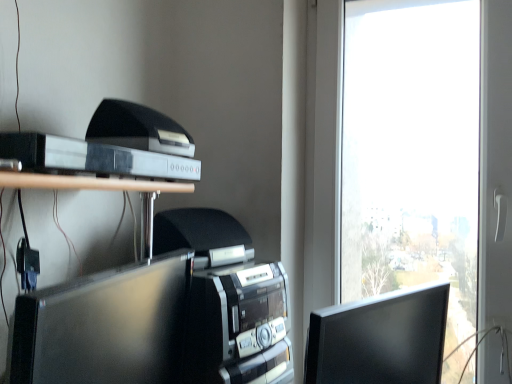
Question: Is black plastic printer at upper left a part of matte black monitor at right, the first computer monitor positioned from the right?

Choices:
 (A) no
 (B) yes

Answer: (A)

Question: Considering the relative sizes of matte black monitor at right, which is the 2th computer monitor from left to right, and black plastic printer at upper left in the image provided, is matte black monitor at right, which is the 2th computer monitor from left to right, thinner than black plastic printer at upper left?

Choices:
 (A) no
 (B) yes

Answer: (A)

Question: Considering the relative positions of matte black monitor at right, which is the 2th computer monitor from left to right, and black plastic printer at upper left in the image provided, is matte black monitor at right, which is the 2th computer monitor from left to right, to the right of black plastic printer at upper left from the viewer's perspective?

Choices:
 (A) yes
 (B) no

Answer: (A)

Question: From a real-world perspective, is matte black monitor at right, which is the 2th computer monitor from left to right, under black plastic printer at upper left?

Choices:
 (A) yes
 (B) no

Answer: (A)

Question: Is matte black monitor at right, which is the 2th computer monitor from left to right, shorter than black plastic printer at upper left?

Choices:
 (A) no
 (B) yes

Answer: (A)

Question: In terms of width, does matte black monitor at center, marked as the second computer monitor in a right-to-left arrangement, look wider or thinner when compared to matte black monitor at right, the first computer monitor positioned from the right?

Choices:
 (A) thin
 (B) wide

Answer: (B)

Question: From a real-world perspective, relative to matte black monitor at right, the first computer monitor positioned from the right, is matte black monitor at center, marked as the second computer monitor in a right-to-left arrangement, vertically above or below?

Choices:
 (A) above
 (B) below

Answer: (A)

Question: Would you say matte black monitor at center, which appears as the first computer monitor when viewed from the left, is to the left or to the right of matte black monitor at right, the first computer monitor positioned from the right, in the picture?

Choices:
 (A) left
 (B) right

Answer: (A)

Question: In terms of size, does matte black monitor at center, which appears as the first computer monitor when viewed from the left, appear bigger or smaller than matte black monitor at right, the first computer monitor positioned from the right?

Choices:
 (A) small
 (B) big

Answer: (B)

Question: From the image's perspective, is black plastic printer at upper left above or below matte black monitor at right, which is the 2th computer monitor from left to right?

Choices:
 (A) above
 (B) below

Answer: (A)

Question: Considering the positions of black plastic printer at upper left and matte black monitor at right, which is the 2th computer monitor from left to right, in the image, is black plastic printer at upper left bigger or smaller than matte black monitor at right, which is the 2th computer monitor from left to right,?

Choices:
 (A) small
 (B) big

Answer: (A)

Question: From a real-world perspective, is black plastic printer at upper left above or below matte black monitor at right, the first computer monitor positioned from the right?

Choices:
 (A) above
 (B) below

Answer: (A)

Question: In terms of height, does black plastic printer at upper left look taller or shorter compared to matte black monitor at right, which is the 2th computer monitor from left to right?

Choices:
 (A) tall
 (B) short

Answer: (B)

Question: From the image's perspective, relative to matte black monitor at center, which appears as the first computer monitor when viewed from the left, is matte black monitor at right, which is the 2th computer monitor from left to right, above or below?

Choices:
 (A) below
 (B) above

Answer: (A)

Question: Is point (372, 317) closer or farther from the camera than point (10, 379)?

Choices:
 (A) closer
 (B) farther

Answer: (B)